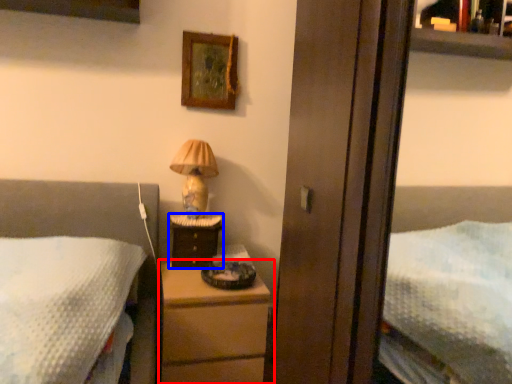
Question: Which point is closer to the camera, chest of drawers (highlighted by a red box) or nightstand (highlighted by a blue box)?

Choices:
 (A) chest of drawers
 (B) nightstand

Answer: (A)